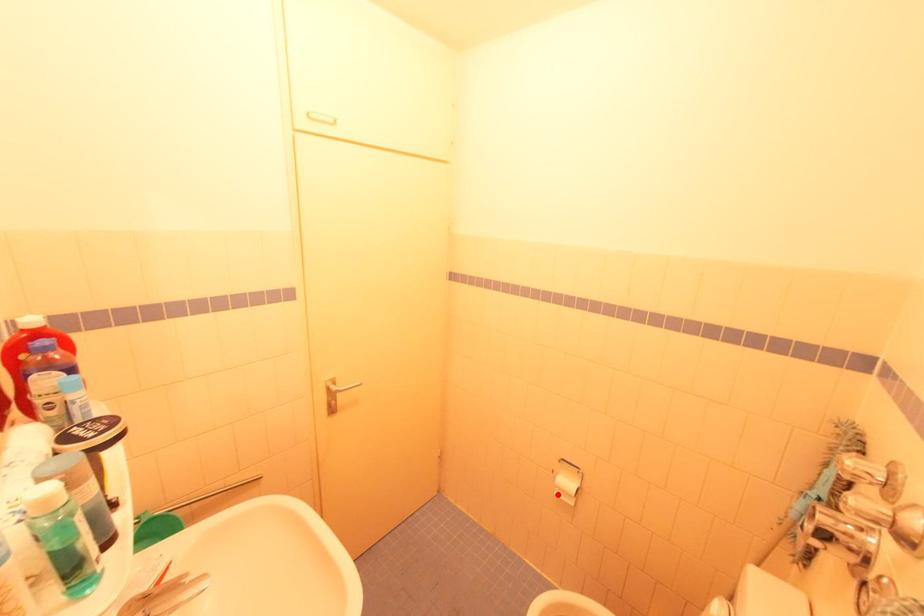
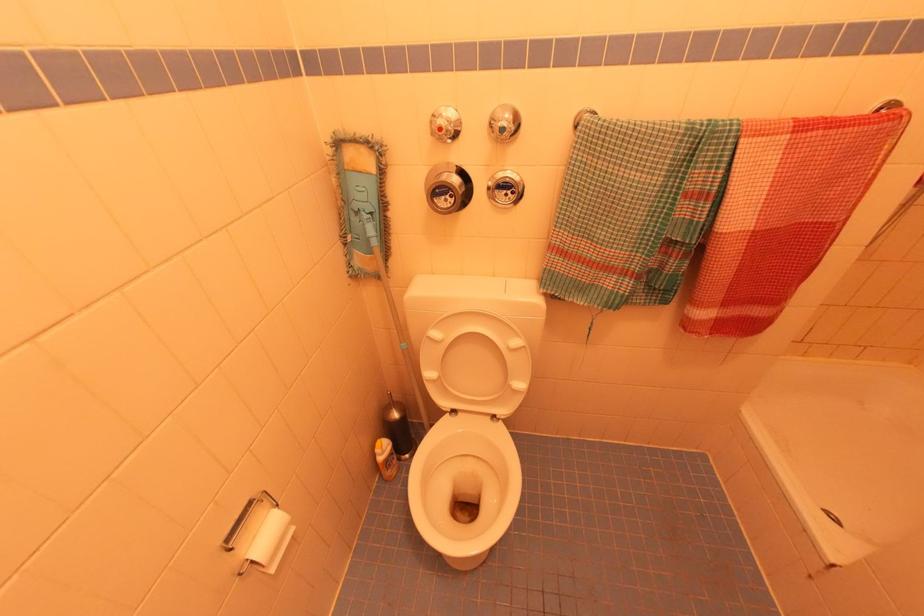
Question: I am providing you with two images of the same scene from different viewpoints. In image1, a red point is highlighted. Considering the same 3D point in image2, which of the following is correct?

Choices:
 (A) It is closer
 (B) It is farther

Answer: (A)